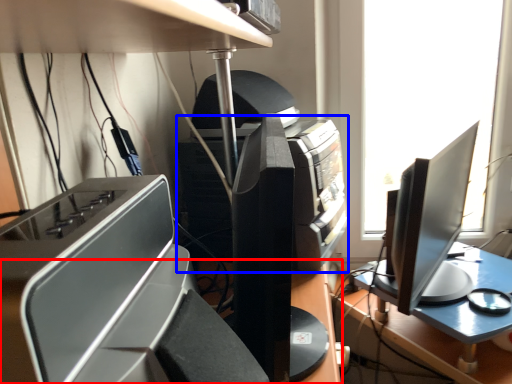
Question: Which object appears closest to the camera in this image, desk (highlighted by a red box) or printer (highlighted by a blue box)?

Choices:
 (A) desk
 (B) printer

Answer: (A)